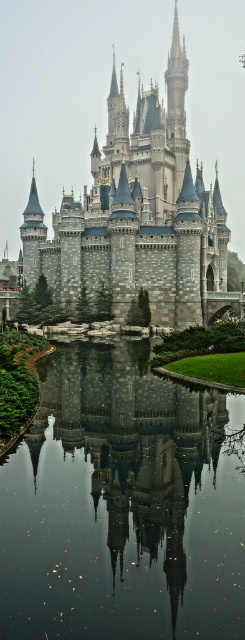
You are a visitor standing in front of the stone castle at center. You want to see your reflection in the transparent glass lake at center. Can you see your reflection in the lake?

The transparent glass lake at center is positioned under the stone castle at center, so yes, you can see your reflection in the lake because it is located directly beneath the castle where you are standing.